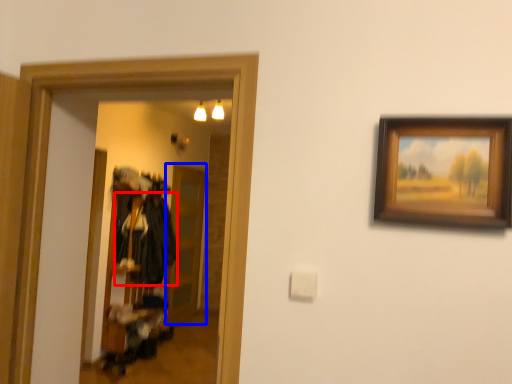
Question: Which object is closer to the camera taking this photo, clothing (highlighted by a red box) or glass door (highlighted by a blue box)?

Choices:
 (A) clothing
 (B) glass door

Answer: (A)